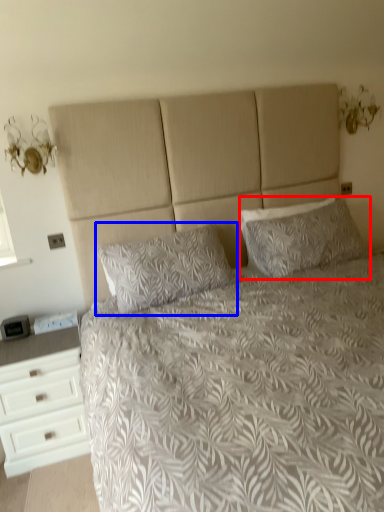
Question: Which of the following is the farthest to the observer, pillow (highlighted by a red box) or pillow (highlighted by a blue box)?

Choices:
 (A) pillow
 (B) pillow

Answer: (A)